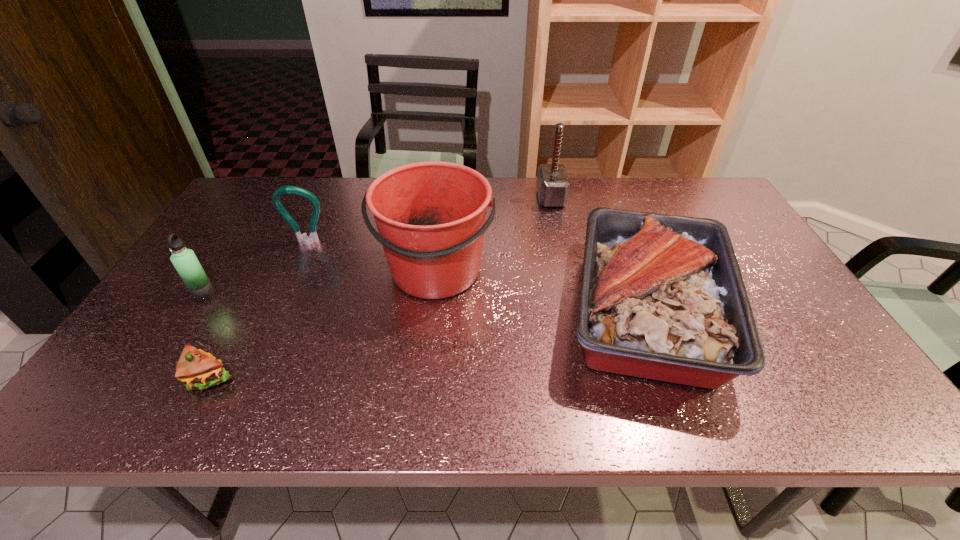
The height and width of the screenshot is (540, 960). Find the location of `the farthest object`. the farthest object is located at coordinates pos(553,184).

Identify the location of bucket. [430, 216].

The height and width of the screenshot is (540, 960). In order to click on bottle opener in this screenshot , I will do `click(313, 237)`.

At what (x,y) coordinates should I click in order to perform the action: click on thermos bottle. Please return your answer as a coordinate pair (x, y). This screenshot has height=540, width=960. Looking at the image, I should click on (184, 260).

Identify the location of the fifth tallest object. (662, 297).

What are the coordinates of `the shortest object` in the screenshot? It's located at (196, 369).

Identify the location of vacant space situated on the front of the hammer. The width and height of the screenshot is (960, 540). (565, 267).

This screenshot has width=960, height=540. Find the location of `free space located 0.050m on the right of the fourth object from left to right`. free space located 0.050m on the right of the fourth object from left to right is located at coordinates (512, 271).

Where is `vacant space situated 0.120m at the jaws of the bottle opener`? This screenshot has height=540, width=960. vacant space situated 0.120m at the jaws of the bottle opener is located at coordinates (293, 276).

At what (x,y) coordinates should I click in order to perform the action: click on vacant region located on the back of the thermos bottle. Please return your answer as a coordinate pair (x, y). Looking at the image, I should click on (248, 226).